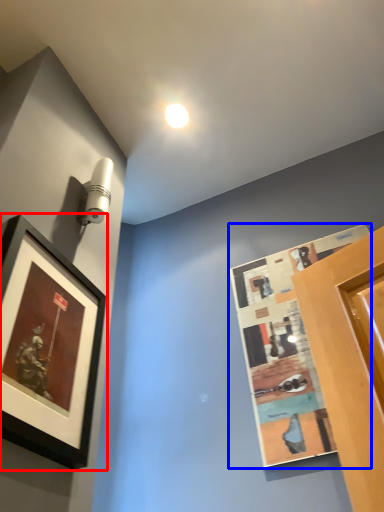
Question: Which object is closer to the camera taking this photo, picture frame (highlighted by a red box) or picture frame (highlighted by a blue box)?

Choices:
 (A) picture frame
 (B) picture frame

Answer: (A)